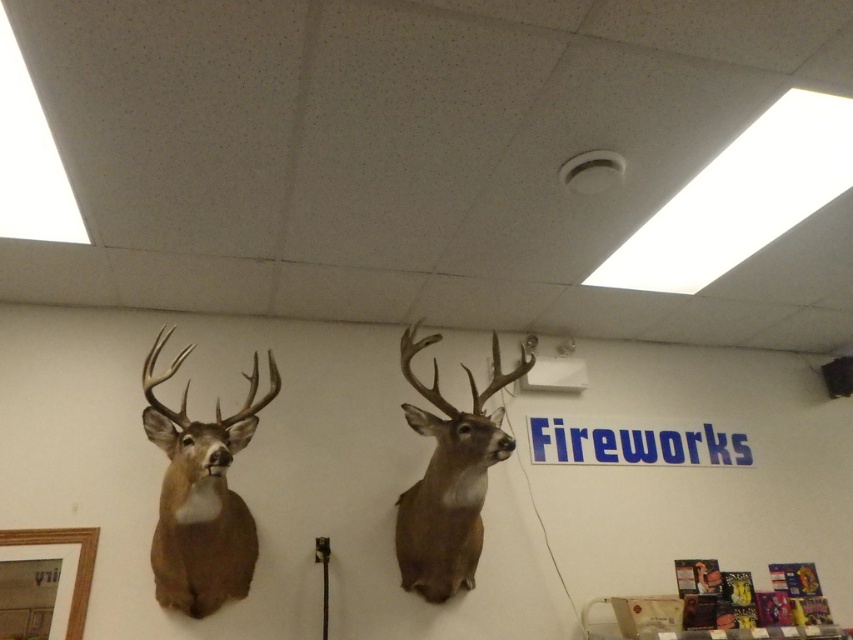
Question: Which object appears closest to the camera in this image?

Choices:
 (A) brown matte/deer head at center
 (B) brown matte/deer head at left

Answer: (B)

Question: Is brown matte/deer head at left bigger than brown matte/deer head at center?

Choices:
 (A) yes
 (B) no

Answer: (B)

Question: Does brown matte/deer head at left have a larger size compared to brown matte/deer head at center?

Choices:
 (A) no
 (B) yes

Answer: (A)

Question: Does brown matte/deer head at left have a smaller size compared to brown matte/deer head at center?

Choices:
 (A) yes
 (B) no

Answer: (A)